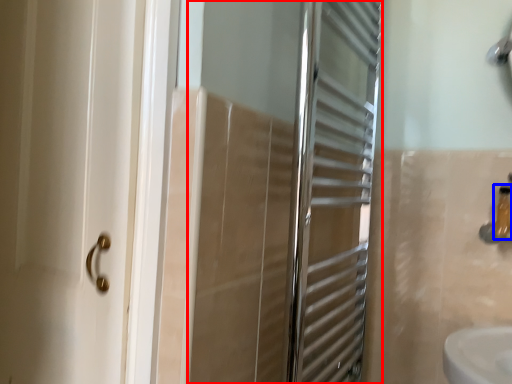
Question: Among these objects, which one is nearest to the camera, screen door (highlighted by a red box) or toiletry (highlighted by a blue box)?

Choices:
 (A) screen door
 (B) toiletry

Answer: (A)